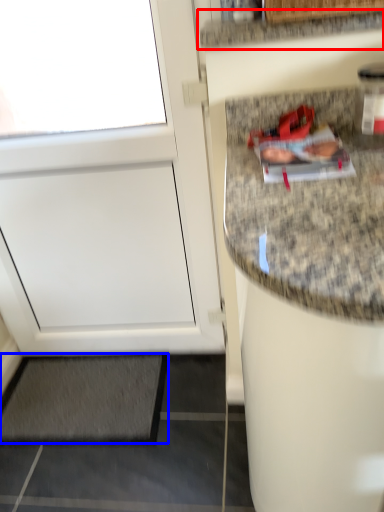
Question: Which of the following is the closest to the observer, countertop (highlighted by a red box) or mat (highlighted by a blue box)?

Choices:
 (A) countertop
 (B) mat

Answer: (A)